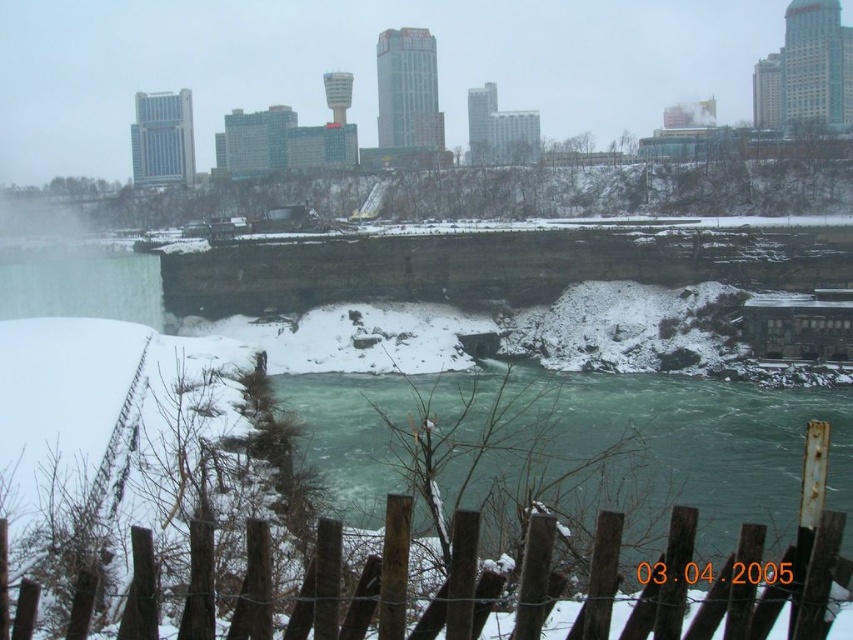
You are standing at the edge of the Niagara Falls and see the green frothy water at center. If you want to locate it precisely, what are its coordinates?

The green frothy water at center is located at coordinates point [584,445].

You are standing at the wooden fence at lower center looking towards the green frothy water at center. Is the water visible from your position?

The green frothy water at center is below the wooden fence at lower center, so yes, the water is visible from your position as the fence is higher up and the water is positioned lower in the scene.